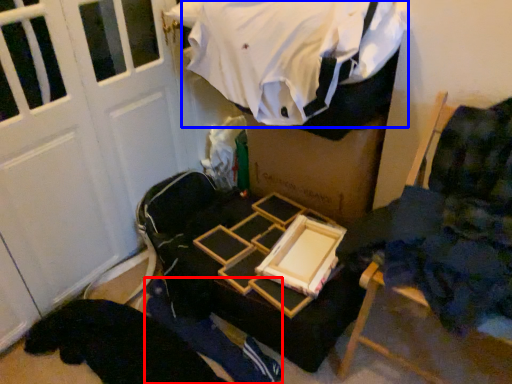
Question: Among these objects, which one is nearest to the camera, person (highlighted by a red box) or clothing (highlighted by a blue box)?

Choices:
 (A) person
 (B) clothing

Answer: (B)